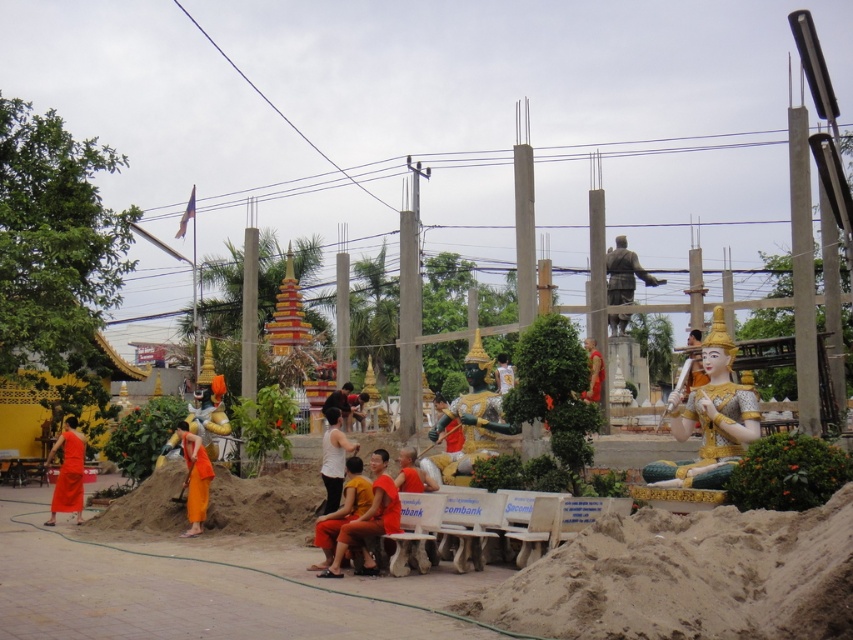
Question: Based on their relative distances, which object is farther from the orange fabric statue at center?

Choices:
 (A) matte orange robe at left
 (B) brown sandy at lower right
 (C) gold/gilded statue at center-right

Answer: (A)

Question: From the image, what is the correct spatial relationship of bronze statue at upper center in relation to orange fabric statue at center?

Choices:
 (A) above
 (B) below

Answer: (A)

Question: Does orange clothed person at center appear on the right side of bronze statue at upper center?

Choices:
 (A) yes
 (B) no

Answer: (B)

Question: Which point appears farthest from the camera in this image?

Choices:
 (A) pyautogui.click(x=729, y=419)
 (B) pyautogui.click(x=483, y=388)
 (C) pyautogui.click(x=189, y=513)
 (D) pyautogui.click(x=761, y=611)

Answer: (B)

Question: Which object is the farthest from the matte orange robe at left?

Choices:
 (A) orange fabric statue at center
 (B) orange cloth at lower left
 (C) bronze statue at upper center
 (D) golden statue at center

Answer: (C)

Question: From the image, what is the correct spatial relationship of bronze statue at upper center in relation to orange cloth at lower left?

Choices:
 (A) above
 (B) below

Answer: (A)